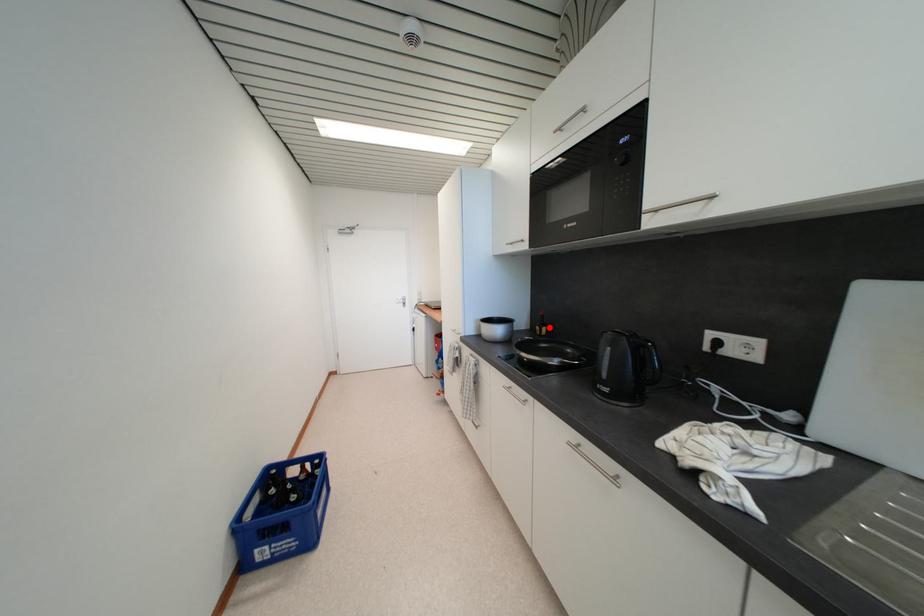
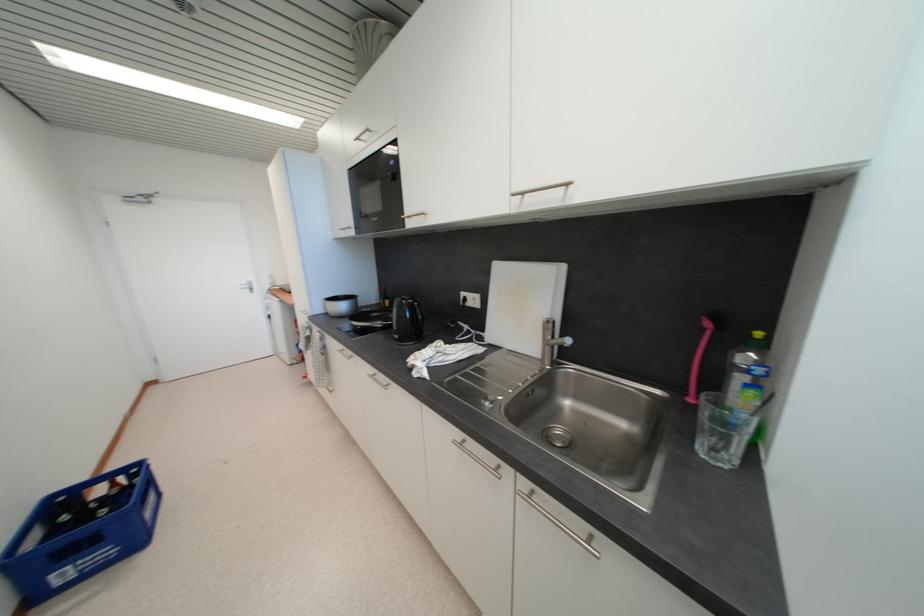
Question: I am providing you with two images of the same scene from different viewpoints. A red point is shown in image1. For the corresponding object point in image2, is it positioned nearer or farther from the camera?

Choices:
 (A) Nearer
 (B) Farther

Answer: (B)